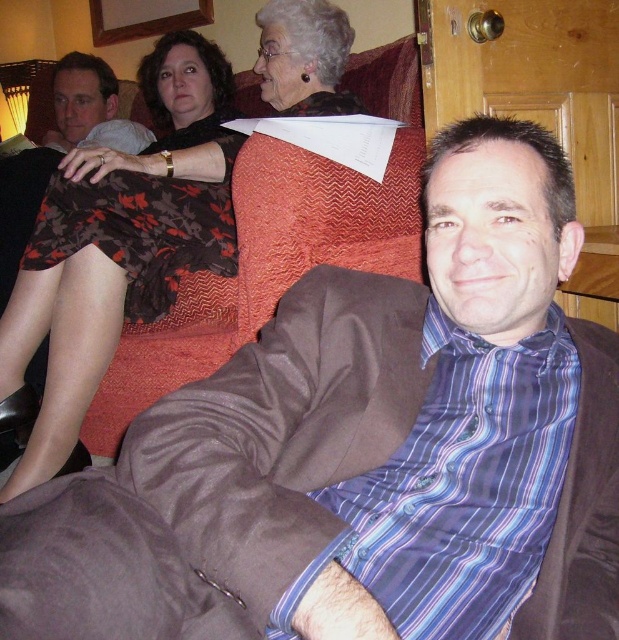
Question: From the image, what is the correct spatial relationship of printed fabric dress at upper left in relation to matte black skirt at upper left?

Choices:
 (A) right
 (B) left

Answer: (A)

Question: Is printed fabric dress at upper left below matte black skirt at upper left?

Choices:
 (A) yes
 (B) no

Answer: (A)

Question: Among these objects, which one is farthest from the camera?

Choices:
 (A) matte black skirt at upper left
 (B) printed fabric dress at upper left

Answer: (A)

Question: Does printed fabric dress at upper left come behind matte black skirt at upper left?

Choices:
 (A) no
 (B) yes

Answer: (A)